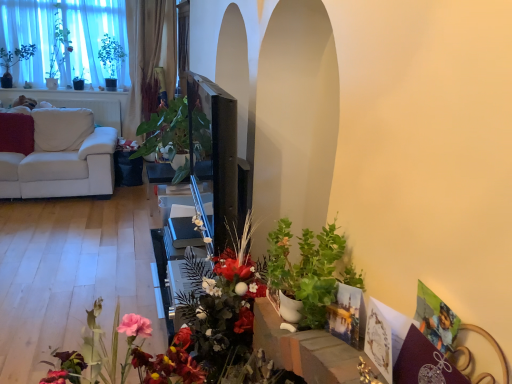
Question: Is point (225, 264) positioned closer to the camera than point (51, 82)?

Choices:
 (A) farther
 (B) closer

Answer: (B)

Question: From a real-world perspective, is matte floral arrangement at center above or below green matte plant at upper left?

Choices:
 (A) below
 (B) above

Answer: (A)

Question: Which of these objects is positioned farthest from the green matte plant at lower right, which appears as the 1th houseplant when viewed from the right?

Choices:
 (A) white fabric couch at left
 (B) matte floral arrangement at center
 (C) green matte plant at upper left
 (D) green glossy plant at center, positioned as the second houseplant in right-to-left order

Answer: (C)

Question: Which of these objects is positioned closest to the green matte plant at upper left?

Choices:
 (A) white fabric couch at left
 (B) green glossy plant at center, positioned as the second houseplant in right-to-left order
 (C) matte floral arrangement at center
 (D) green matte plant at lower right, which appears as the 1th houseplant when viewed from the right

Answer: (A)